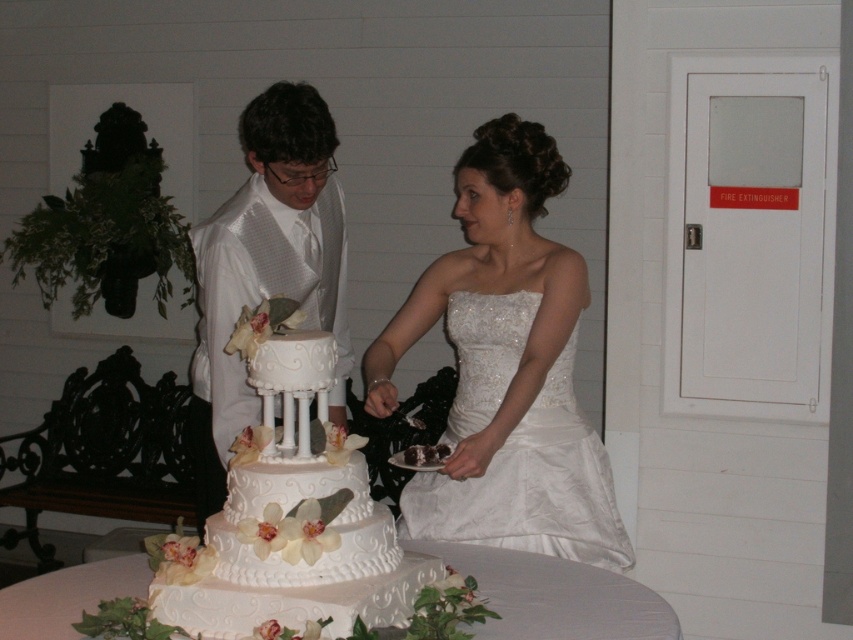
Consider the image. You are a photographer at the wedding and want to capture a closeup shot of the cake. The white glossy wedding cake at center and white textured cake at center are both on the table. Which cake should you focus on to ensure it appears larger in the photo?

The white glossy wedding cake at center is much taller than the white textured cake at center, so focusing on it will make it appear larger in the photo.